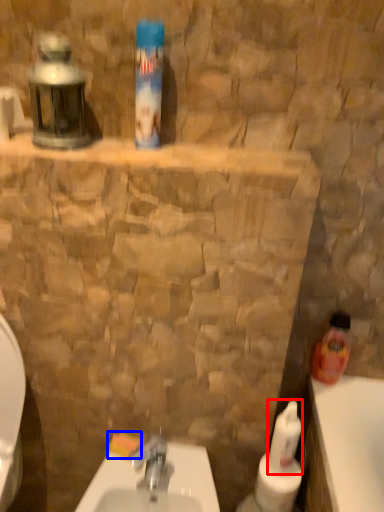
Question: Which of the following is the farthest to the observer, cleaning product (highlighted by a red box) or soap (highlighted by a blue box)?

Choices:
 (A) cleaning product
 (B) soap

Answer: (B)